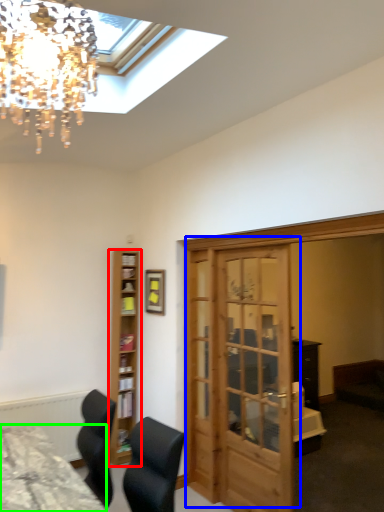
Question: Which object is the farthest from shelf (highlighted by a red box)? Choose among these: door (highlighted by a blue box) or desk (highlighted by a green box).

Choices:
 (A) door
 (B) desk

Answer: (B)